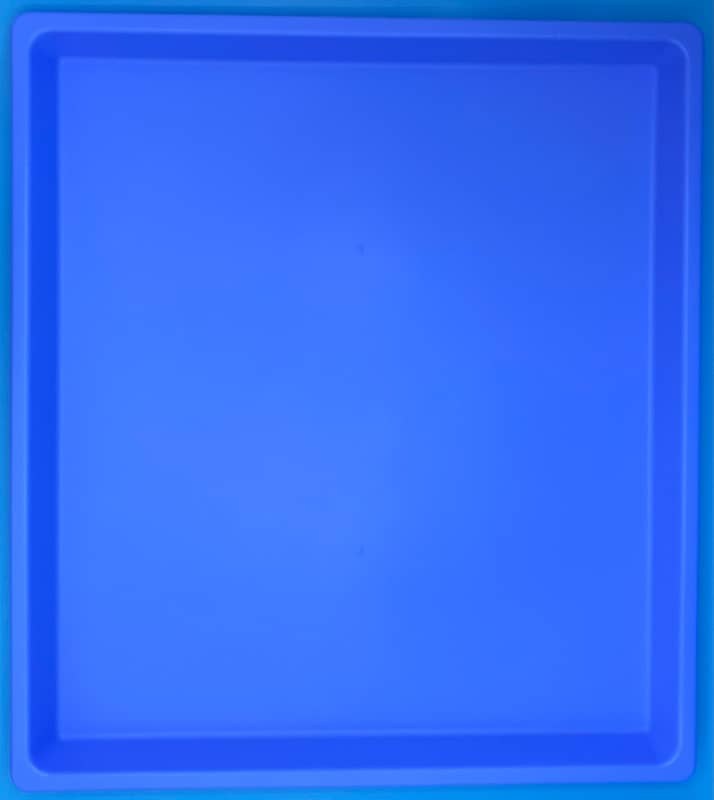
This screenshot has height=800, width=714. What are the coordinates of `four corners of bottom of tray` in the screenshot? It's located at (60, 56), (658, 68), (648, 726), (61, 732).